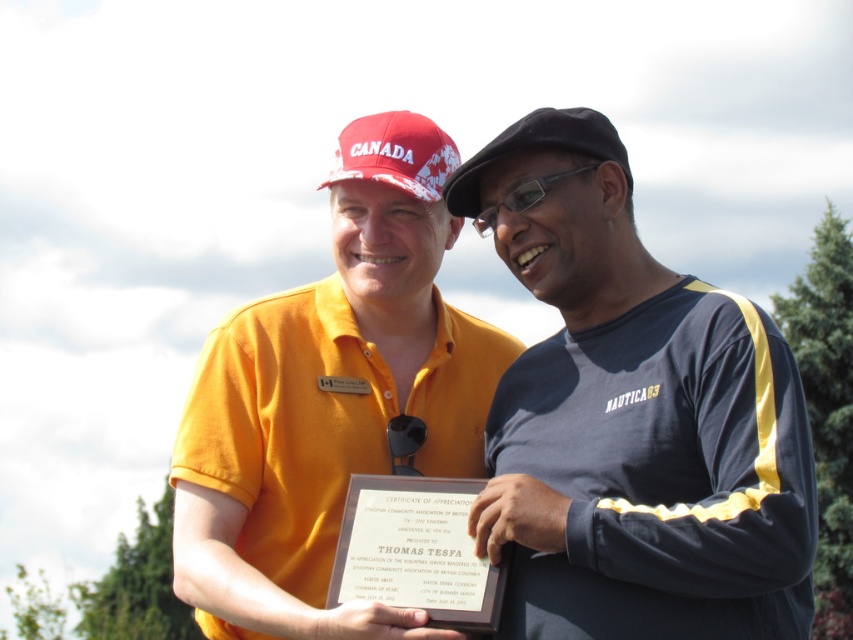
In the scene shown: You are a photographer standing 50 feet away from the scene. You want to take a closeup photo of the white paper plaque at center without including the black fabric baseball cap at upper center. Is this possible given their distance apart?

The white paper plaque at center is 51.33 feet away from the black fabric baseball cap at upper center. Since you are standing 50 feet away from the scene, the distance between the plaque and the cap is greater than your distance from the scene. This means you can likely frame the shot to capture the white paper plaque at center while excluding the black fabric baseball cap at upper center.

You are taking a photo of two people holding a certificate. You notice two points on the certificate labeled as point 1 and point 2. If point 1 is at coordinate (398, 572) and point 2 is at (521, 186), which point is closer to the camera?

Point 1 at coordinate (398, 572) is closer to the camera than point 2 at (521, 186).

You are a photographer taking a picture of the two people holding the white paper plaque at center and the transparent plastic glasses at center. To ensure both items are clearly visible in the photo, which one should you focus on first? Explain your reasoning based on their positions.

The white paper plaque at center is to the left of transparent plastic glasses at center. Since the plaque is positioned to the left, focusing on it first would help ensure both items are in frame and properly aligned.